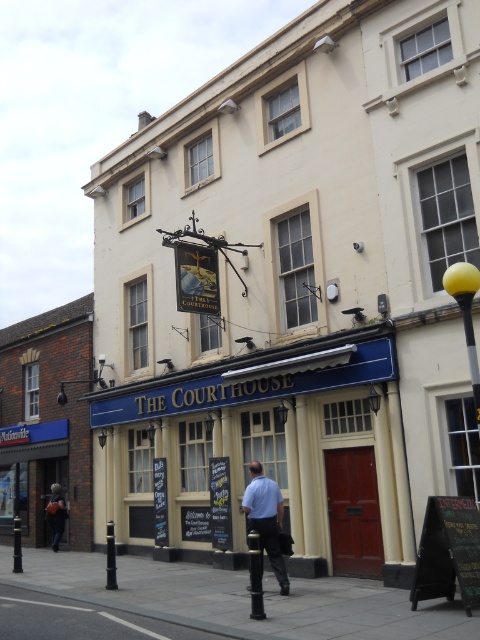
You are standing on the street looking at THE COURTHOUSE building. There are two points marked on the building facade. The first point is at coordinates point (290, 483) and the second is at point (284, 563). Which point is closer to you?

Point (290, 483) is closer to you because it is further to the viewer than point (284, 563).

You are standing on the sidewalk in front of THE COURTHOUSE. You notice two points marked on the building facade. The first point is at coordinates point [139,637] and the second is at point [286,593]. Which of these points is closer to you as you face the building?

Point [139,637] is in front of point [286,593], so it is closer to you as you face the building.